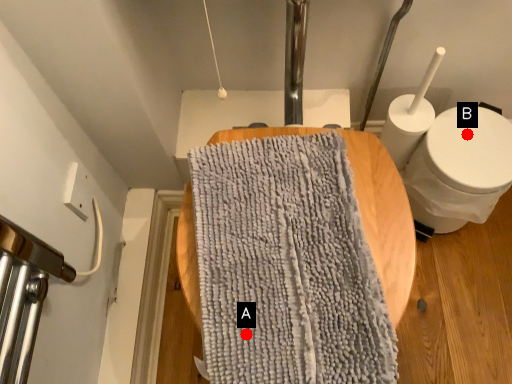
Question: Two points are circled on the image, labeled by A and B beside each circle. Which of the following is the closest to the observer?

Choices:
 (A) A is closer
 (B) B is closer

Answer: (A)